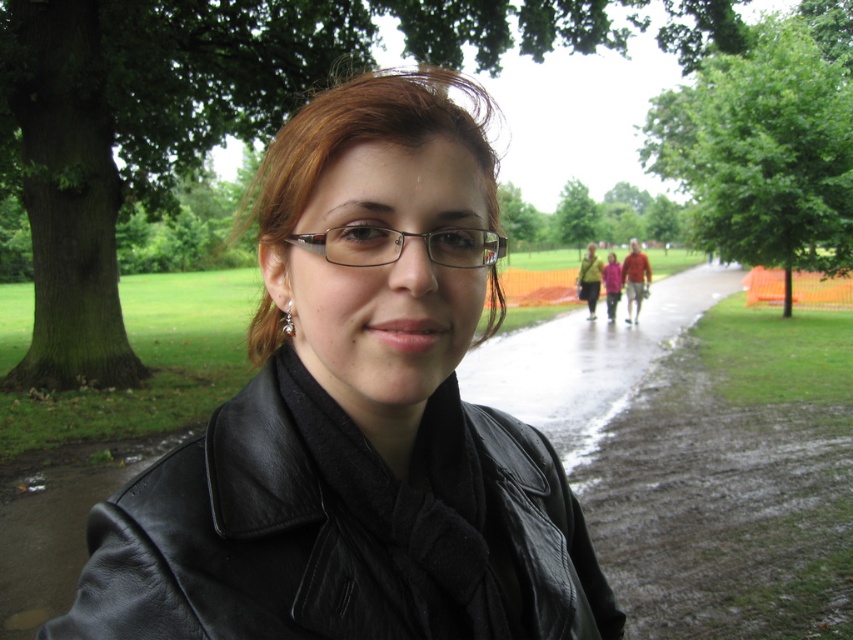
Question: Estimate the real-world distances between objects in this image. Which object is farther from the matte black glasses at center?

Choices:
 (A) green leafy tree at upper right
 (B) black leather jacket at center
 (C) green leafy tree at upper left

Answer: (A)

Question: Which point appears closest to the camera in this image?

Choices:
 (A) (445, 618)
 (B) (349, 236)
 (C) (763, 44)
 (D) (593, 224)

Answer: (B)

Question: Can you confirm if green leafy tree at upper right is positioned below green leafy tree at center?

Choices:
 (A) yes
 (B) no

Answer: (B)

Question: Can you confirm if black leather jacket at center is positioned to the right of matte black jacket at center?

Choices:
 (A) no
 (B) yes

Answer: (A)

Question: Which point is farther from the camera taking this photo?

Choices:
 (A) (418, 467)
 (B) (293, 237)
 (C) (630, 294)

Answer: (C)

Question: Is green leafy tree at upper left above green leafy tree at upper right?

Choices:
 (A) yes
 (B) no

Answer: (A)